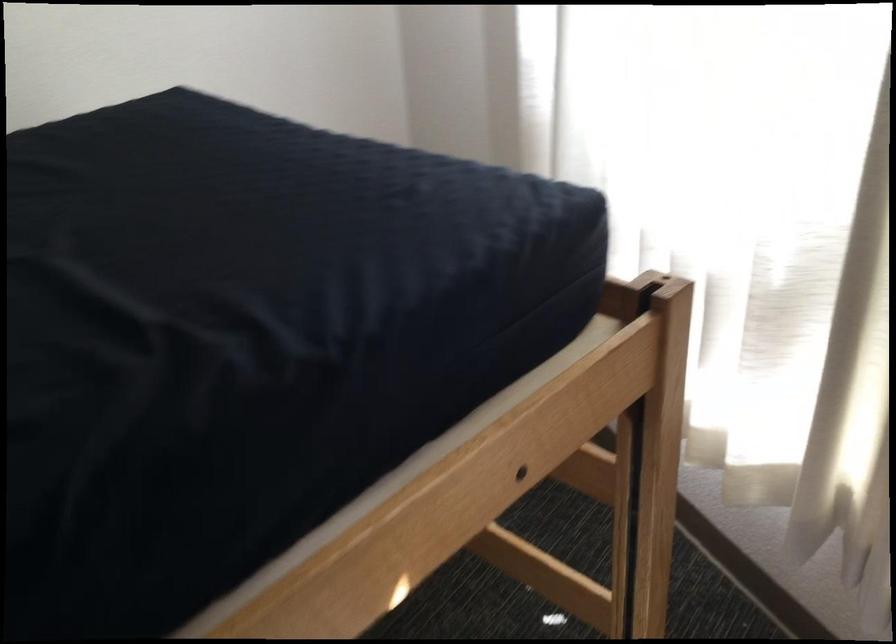
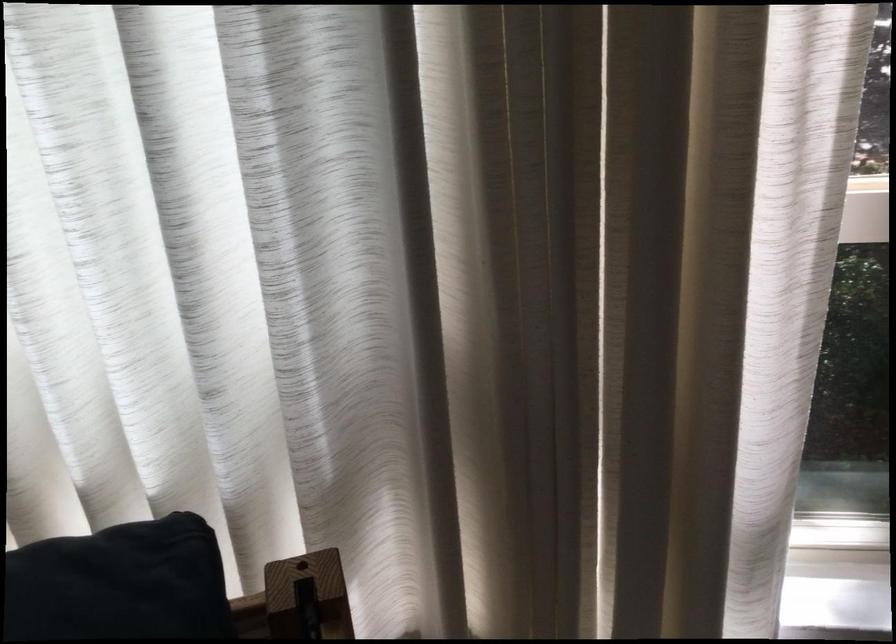
Where in the second image is the point corresponding to the point at 523,202 from the first image?

(119, 583)